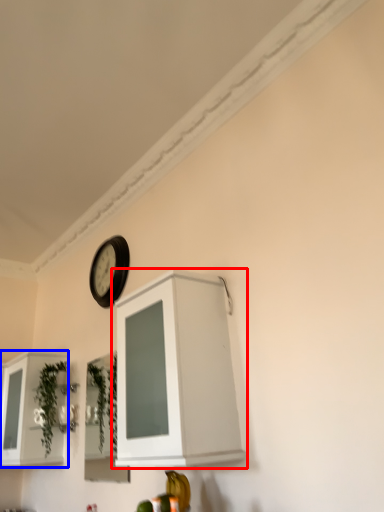
Question: Which object appears closest to the camera in this image, cabinetry (highlighted by a red box) or cabinetry (highlighted by a blue box)?

Choices:
 (A) cabinetry
 (B) cabinetry

Answer: (A)